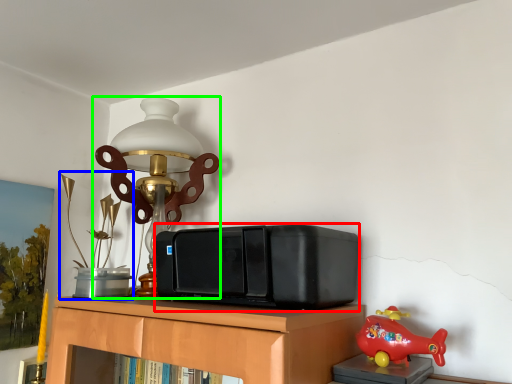
Question: Which is nearer to the stereo (highlighted by a red box)? toy (highlighted by a blue box) or lamp (highlighted by a green box).

Choices:
 (A) toy
 (B) lamp

Answer: (B)